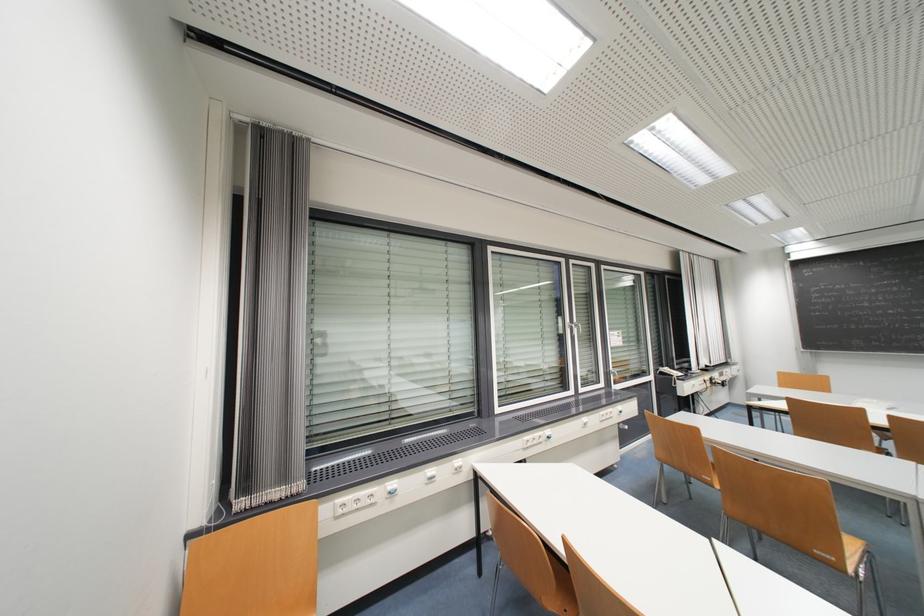
This screenshot has width=924, height=616. What do you see at coordinates (575, 328) in the screenshot? I see `the silver window handle` at bounding box center [575, 328].